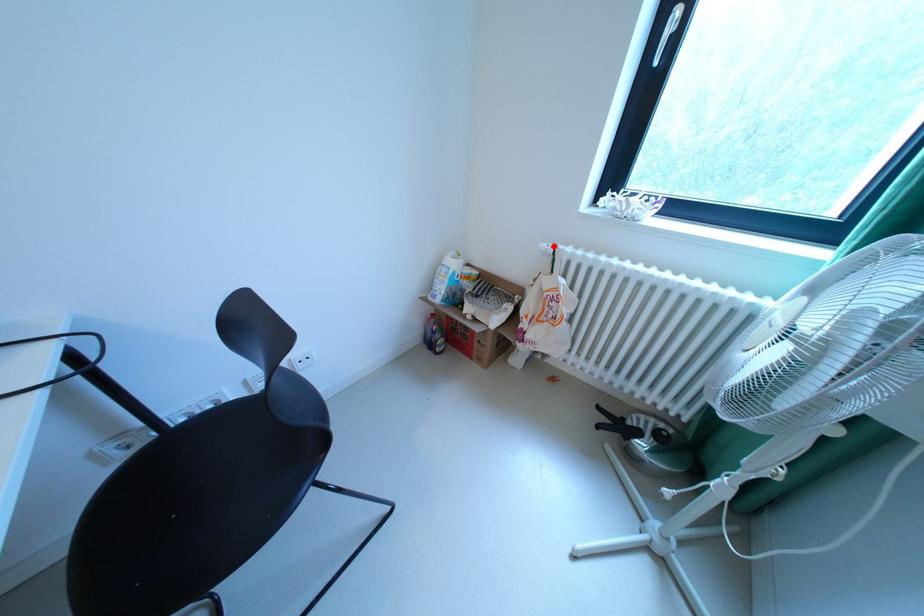
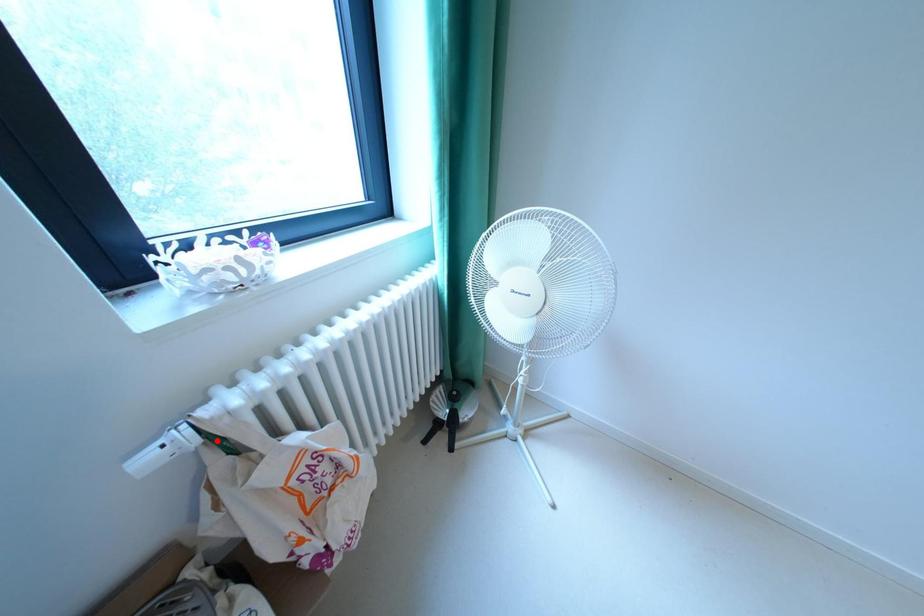
I am providing you with two images of the same scene from different viewpoints. A red point is marked on the first image and another point is marked on the second image. Do the highlighted points in image1 and image2 indicate the same real-world spot?

No